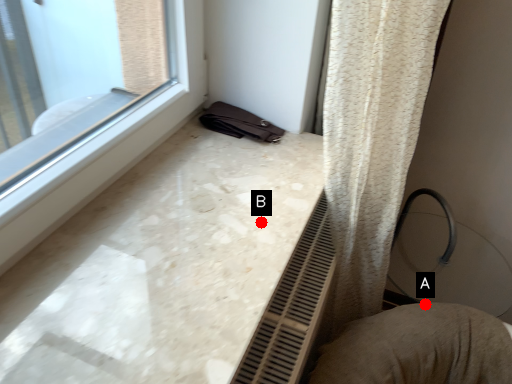
Question: Two points are circled on the image, labeled by A and B beside each circle. Among these points, which one is nearest to the camera?

Choices:
 (A) A is closer
 (B) B is closer

Answer: (B)